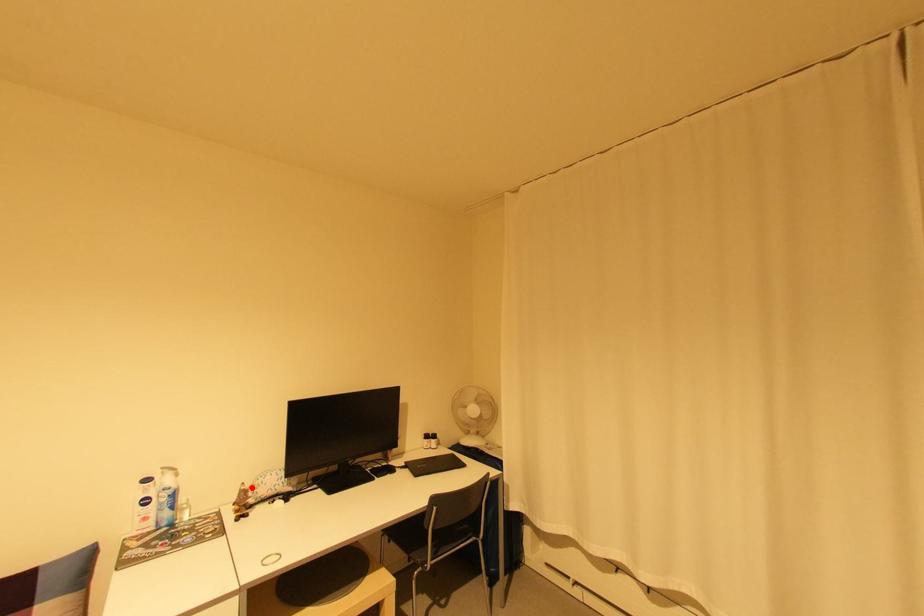
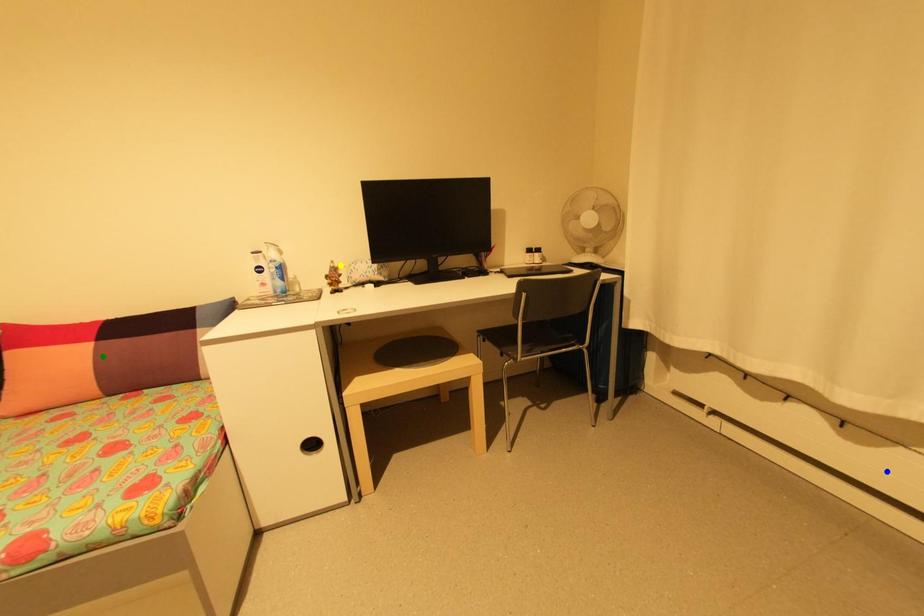
Question: I am providing you with two images of the same scene from different viewpoints. A red point is marked on the first image. You are given multiple points on the second image. In image 2, which mark is for the same physical point as the one in image 1?

Choices:
 (A) blue point
 (B) yellow point
 (C) green point

Answer: (B)